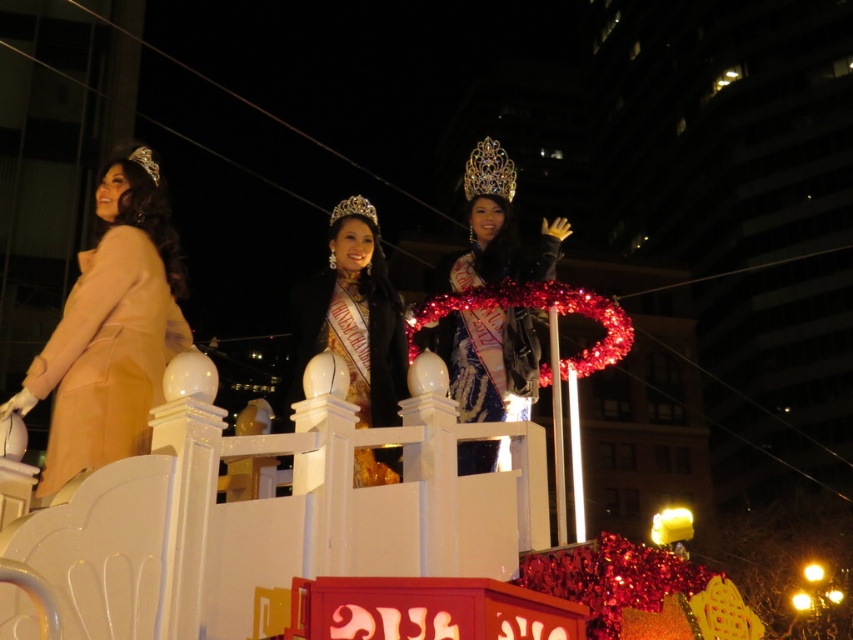
Question: Which of the following is the closest to the observer?

Choices:
 (A) (380, 358)
 (B) (111, 205)

Answer: (B)

Question: Which point appears closest to the camera in this image?

Choices:
 (A) (560, 237)
 (B) (334, 324)

Answer: (B)

Question: Does beige satin coat at left have a smaller size compared to shiny blue dress at center?

Choices:
 (A) no
 (B) yes

Answer: (A)

Question: Is shiny blue dress at center below gold satin sash at center?

Choices:
 (A) yes
 (B) no

Answer: (B)

Question: Is beige satin coat at left below gold satin sash at center?

Choices:
 (A) no
 (B) yes

Answer: (A)

Question: Which point appears closest to the camera in this image?

Choices:
 (A) (74, 344)
 (B) (337, 336)
 (C) (428, 348)

Answer: (A)